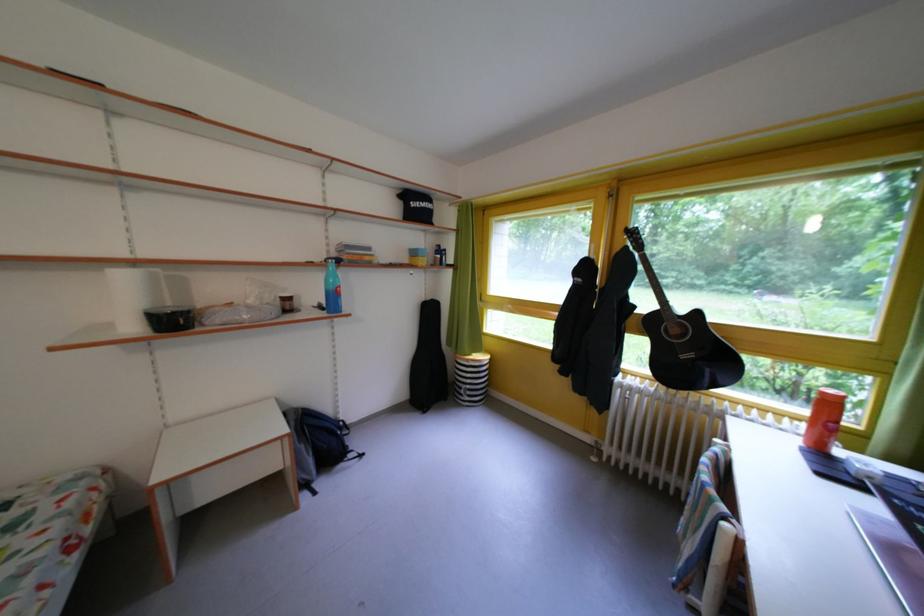
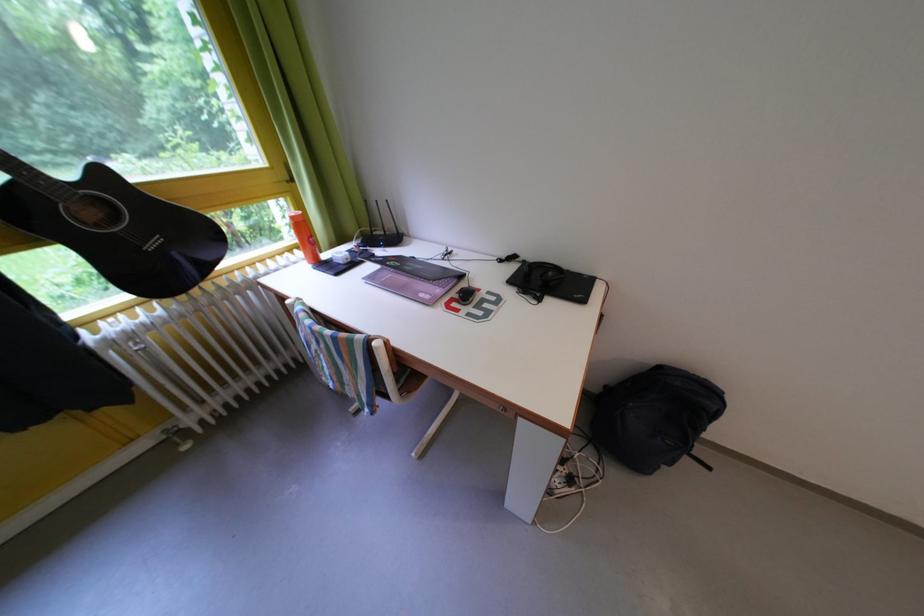
Where in the second image is the point corresponding to [639,395] from the first image?

(140, 342)